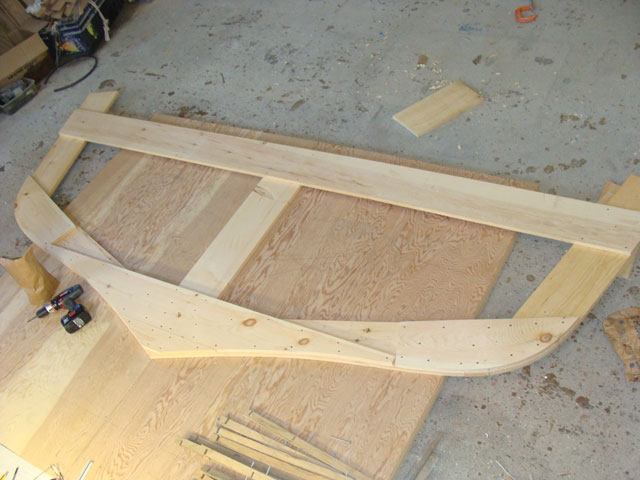
Locate an element on the screen. This screenshot has width=640, height=480. wooden platform is located at coordinates (340, 283).